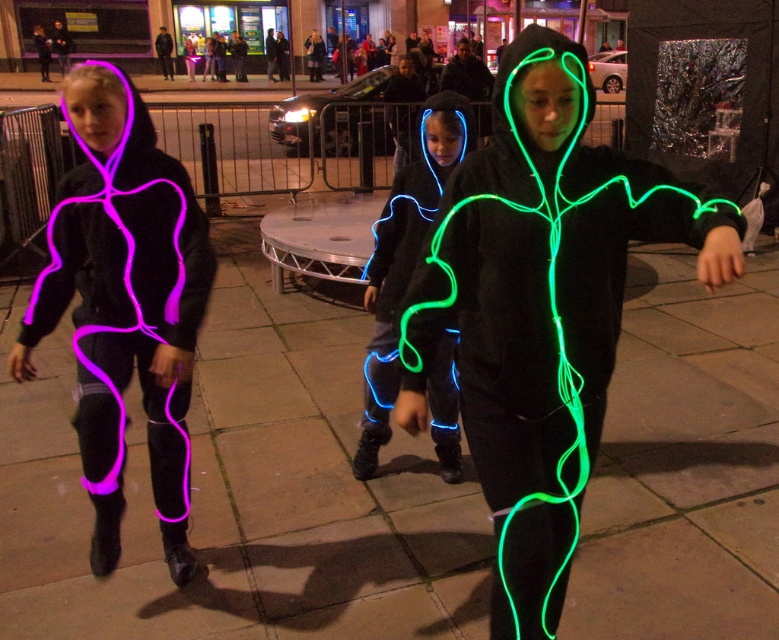
You are standing at the origin point of the image coordinate system. The origin is at the bottom left corner of the image. You want to walk towards the matte black hoodie at left. In which direction should you move relative to the current position?

Since the matte black hoodie at left is located at point 0.458 in the x coordinate and 0.159 in the y coordinate, and the origin is at the bottom left corner, you should move diagonally upwards and to the right to reach it.

You are a city planner analyzing the layout of this urban scene. Where exactly is the green neon lines at center located in terms of coordinates?

The green neon lines at center are located at coordinates point (541, 307).

You are a photographer trying to capture the neon blue fabric at center and the matte black hoodie at left in the same frame. Based on their positions, which one should you adjust your camera to focus on first to ensure both are in the shot?

The matte black hoodie at left is positioned on the left side of neon blue fabric at center, so you should focus on the matte black hoodie at left first to ensure both are included in the frame.